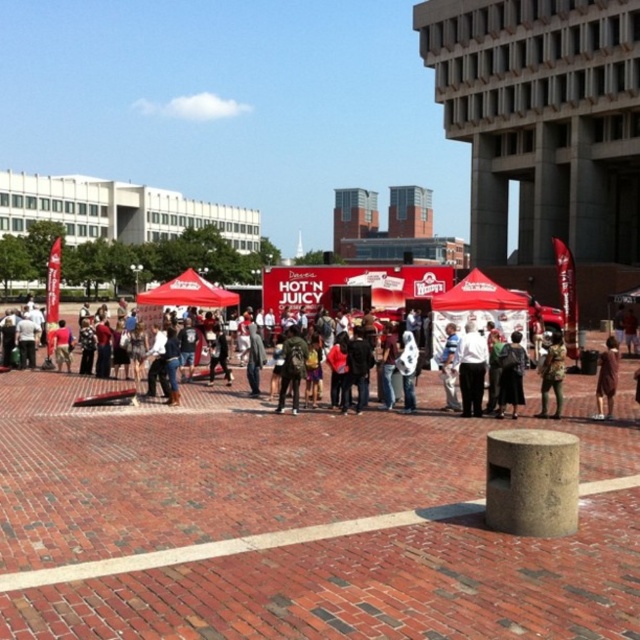
Does white shirt at center lie in front of green backpack at center?

Yes, white shirt at center is in front of green backpack at center.

Based on the photo, does white shirt at center appear on the left side of green backpack at center?

No, white shirt at center is not to the left of green backpack at center.

Where is `white shirt at center`? The width and height of the screenshot is (640, 640). white shirt at center is located at coordinates (472, 369).

Is point (552, 356) behind point (637, 401)?

No, (552, 356) is closer to viewer.

Can you confirm if camouflage jacket at center is shorter than brown leather jacket at center?

No, camouflage jacket at center is not shorter than brown leather jacket at center.

Find the location of a particular element. This screenshot has width=640, height=640. camouflage jacket at center is located at coordinates (552, 376).

Where is `camouflage jacket at center`? The image size is (640, 640). camouflage jacket at center is located at coordinates (552, 376).

Can you confirm if white shirt at center is shorter than brown fabric dress at center?

Incorrect, white shirt at center's height does not fall short of brown fabric dress at center's.

Which is behind, point (458, 372) or point (600, 419)?

Point (458, 372)

Find the location of a particular element. white shirt at center is located at coordinates (472, 369).